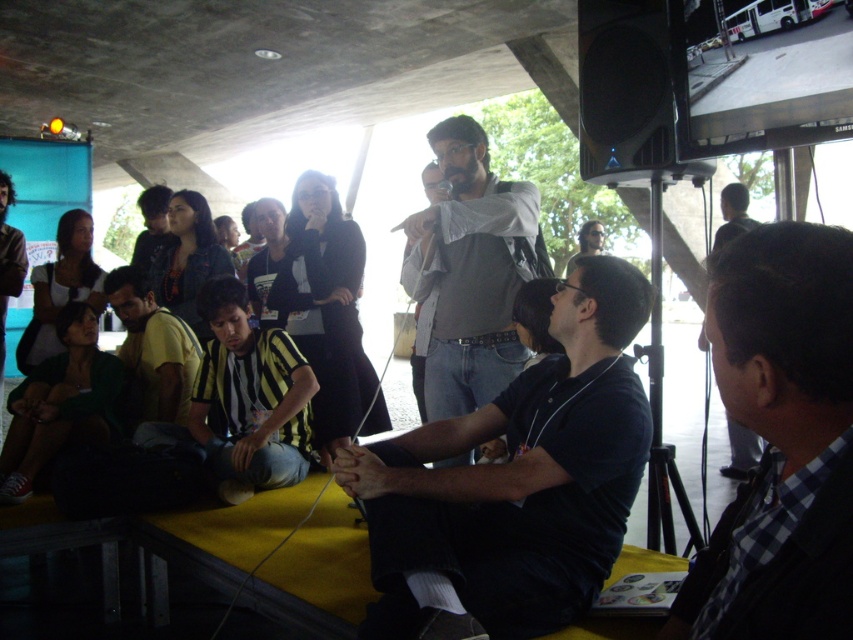
Question: Which point appears farthest from the camera in this image?

Choices:
 (A) (184, 381)
 (B) (456, 547)
 (C) (718, 563)

Answer: (A)

Question: Which of the following is the closest to the observer?

Choices:
 (A) matte gray shirt at center
 (B) black checkered shirt at lower right

Answer: (B)

Question: Does black checkered shirt at lower right come in front of yellow/yellowish fabric at lower left?

Choices:
 (A) no
 (B) yes

Answer: (B)

Question: Is gray shirt at center to the right of yellow/yellowish fabric at lower left from the viewer's perspective?

Choices:
 (A) yes
 (B) no

Answer: (A)

Question: Can you confirm if black checkered shirt at lower right is thinner than yellow/yellowish fabric at lower left?

Choices:
 (A) yes
 (B) no

Answer: (A)

Question: Among these points, which one is nearest to the camera?

Choices:
 (A) (596, 250)
 (B) (511, 544)

Answer: (B)